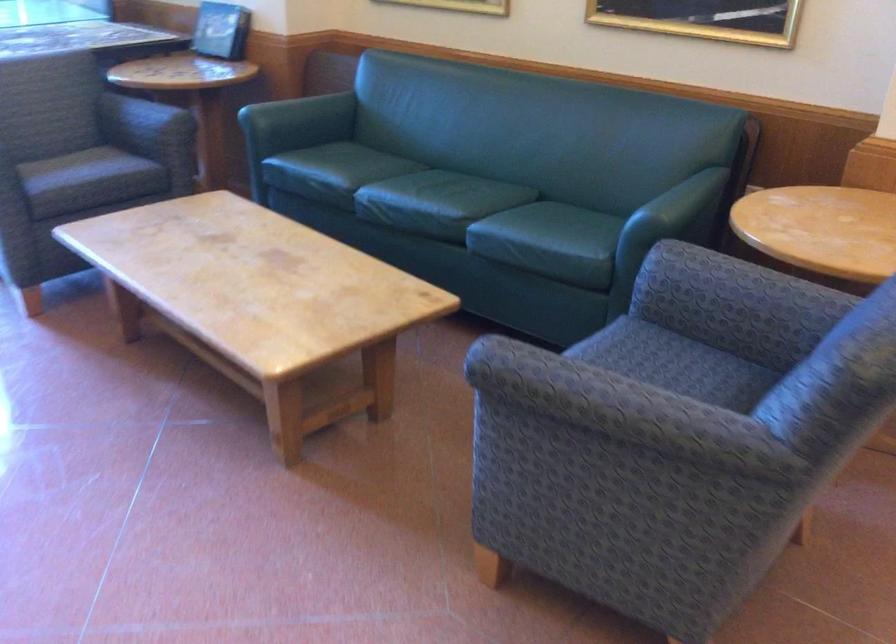
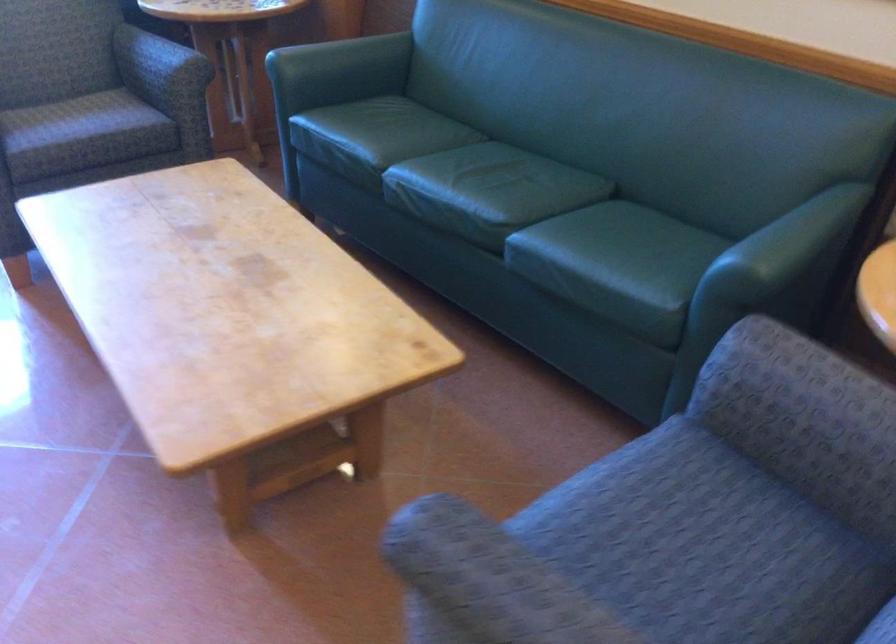
In the second image, find the point that corresponds to [709,285] in the first image.

(796, 404)